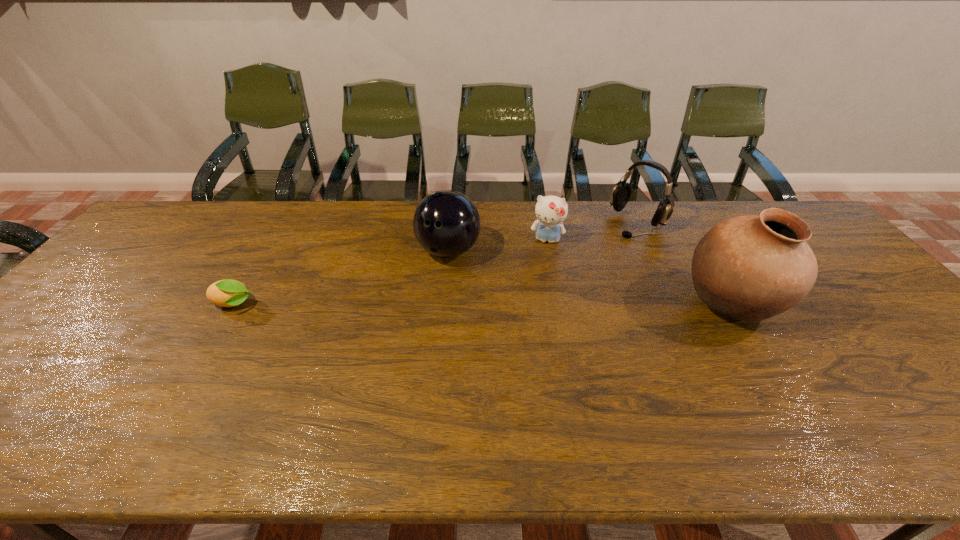
Locate an element on the screen. This screenshot has height=540, width=960. free spot on the desktop that is between the lemon and the tallest object and is positioned on the front-facing side of the third object from left to right is located at coordinates pos(534,305).

The width and height of the screenshot is (960, 540). Identify the location of free space on the desktop that is between the shortest object and the tallest object and is positioned with the microphone on the side of the headset. (544, 305).

Find the location of `free space on the desktop that is between the leftmost object and the tallest object and is positioned on the side of the bowling ball with the finger holes`. free space on the desktop that is between the leftmost object and the tallest object and is positioned on the side of the bowling ball with the finger holes is located at coordinates (424, 305).